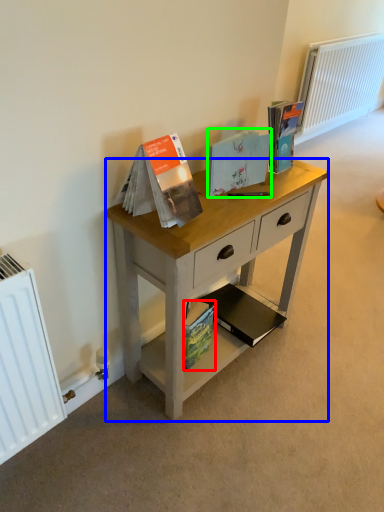
Question: Which object is the farthest from paperback book (highlighted by a red box)? Choose among these: desk (highlighted by a blue box) or paperback book (highlighted by a green box).

Choices:
 (A) desk
 (B) paperback book

Answer: (B)